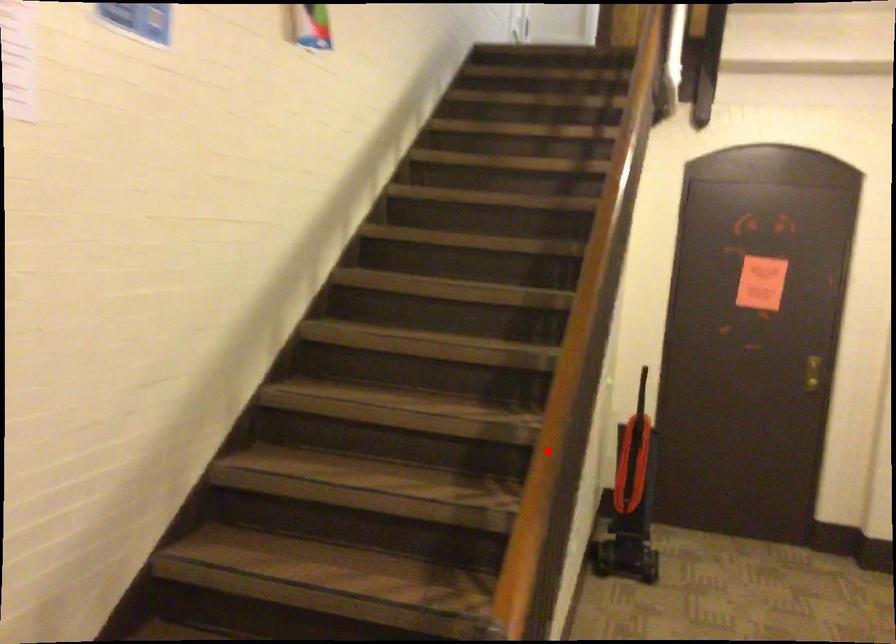
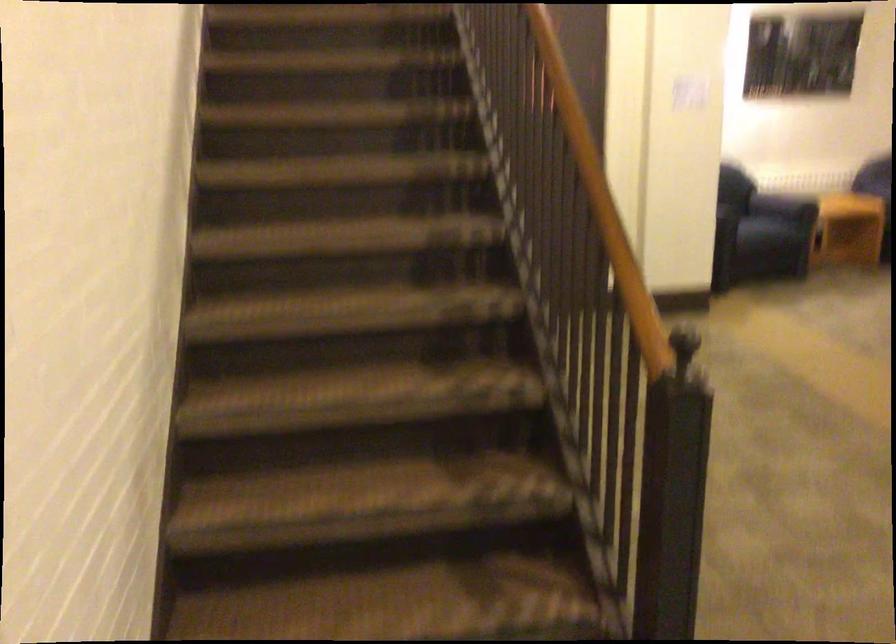
Locate, in the second image, the point that corresponds to the highlighted location in the first image.

(608, 216)